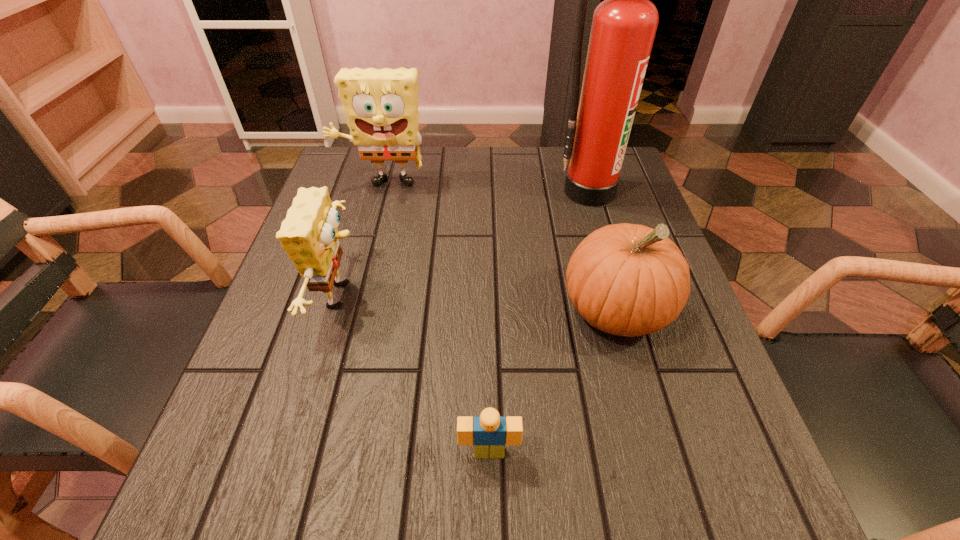
This screenshot has height=540, width=960. I want to click on empty space that is in between the fourth shortest object and the pumpkin, so click(499, 248).

Select which object is the closest to the farther sponge. Please provide its 2D coordinates. Your answer should be formatted as a tuple, i.e. [(x, y)], where the tuple contains the x and y coordinates of a point satisfying the conditions above.

[(309, 235)]

Locate an element on the screen. The image size is (960, 540). object that stands as the fourth closest to the second tallest object is located at coordinates (489, 432).